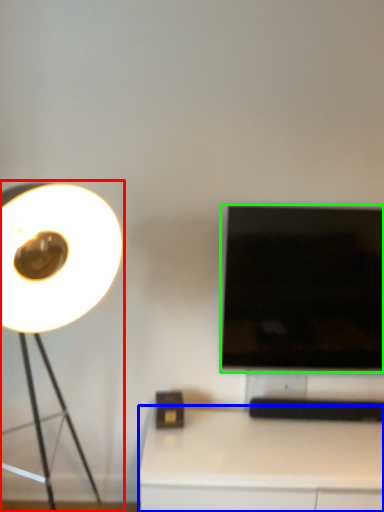
Question: Estimate the real-world distances between objects in this image. Which object is closer to lamp (highlighted by a red box), table (highlighted by a blue box) or television (highlighted by a green box)?

Choices:
 (A) table
 (B) television

Answer: (B)